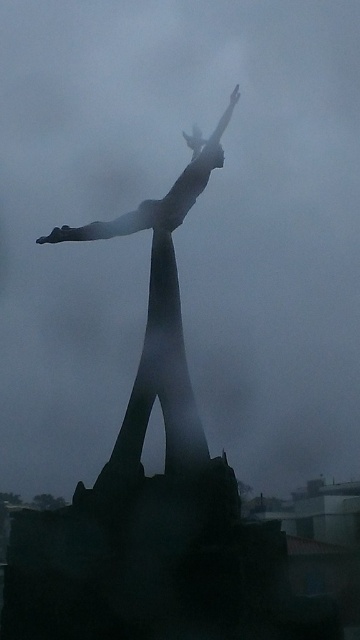
Question: Can you confirm if bronze statue at center is positioned to the right of satin silver arm at center?

Choices:
 (A) no
 (B) yes

Answer: (B)

Question: Does satin silver arm at center have a larger size compared to satin silver arm at upper center?

Choices:
 (A) no
 (B) yes

Answer: (B)

Question: Which of the following is the farthest from the observer?

Choices:
 (A) satin silver arm at upper center
 (B) bronze statue at center
 (C) satin silver arm at center

Answer: (A)

Question: Which point is closer to the camera?

Choices:
 (A) (137, 440)
 (B) (38, 241)
 (C) (225, 116)

Answer: (A)

Question: Which object is the closest to the bronze statue at center?

Choices:
 (A) satin silver arm at center
 (B) satin silver arm at upper center

Answer: (B)

Question: From the image, what is the correct spatial relationship of satin silver arm at center in relation to satin silver arm at upper center?

Choices:
 (A) below
 (B) above

Answer: (A)